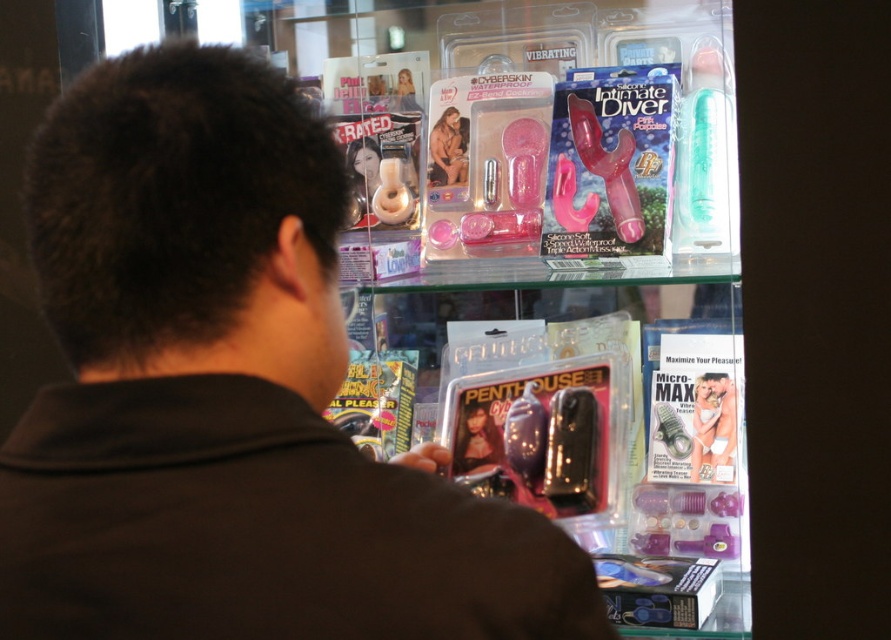
Question: Is black matte shirt at upper left positioned behind smooth plastic barbie at center?

Choices:
 (A) yes
 (B) no

Answer: (B)

Question: Is black matte shirt at upper left smaller than smooth plastic barbie at center?

Choices:
 (A) no
 (B) yes

Answer: (A)

Question: Which point appears closest to the camera in this image?

Choices:
 (A) (436, 129)
 (B) (699, 429)
 (C) (19, 513)

Answer: (C)

Question: Based on their relative distances, which object is farther from the matte plastic barbie at upper center?

Choices:
 (A) black matte shirt at upper left
 (B) smooth plastic barbie at center

Answer: (A)

Question: Which object is positioned farthest from the matte plastic barbie at upper center?

Choices:
 (A) smooth plastic barbie at center
 (B) black matte shirt at upper left

Answer: (B)

Question: Does smooth plastic barbie at center have a smaller size compared to matte plastic barbie at upper center?

Choices:
 (A) no
 (B) yes

Answer: (A)